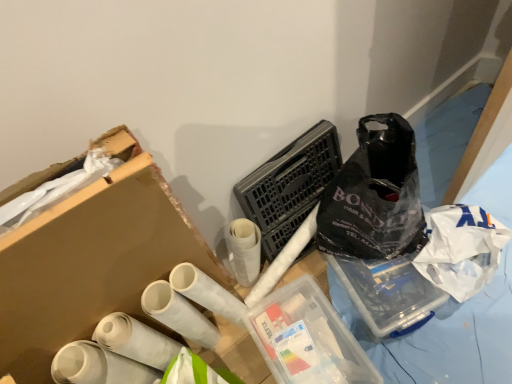
Question: Does transparent plastic container at center have a lesser height compared to white matte toilet paper at lower left, which appears as the second toilet paper when viewed from the right?

Choices:
 (A) yes
 (B) no

Answer: (A)

Question: From a real-world perspective, is transparent plastic container at center located higher than white matte toilet paper at lower left, which appears as the second toilet paper when viewed from the right?

Choices:
 (A) no
 (B) yes

Answer: (A)

Question: Does transparent plastic container at center turn towards white matte toilet paper at lower left, the 2th toilet paper from the left?

Choices:
 (A) yes
 (B) no

Answer: (B)

Question: Is transparent plastic container at center beside white matte toilet paper at lower left, which appears as the second toilet paper when viewed from the right?

Choices:
 (A) no
 (B) yes

Answer: (A)

Question: Is transparent plastic container at center further to camera compared to white matte toilet paper at lower left, the 2th toilet paper from the left?

Choices:
 (A) yes
 (B) no

Answer: (A)

Question: Would you say transparent plastic container at center is inside or outside white matte toilet paper at lower left, the 3th toilet paper when ordered from right to left?

Choices:
 (A) inside
 (B) outside

Answer: (B)

Question: Is transparent plastic container at center wider or thinner than white matte toilet paper at lower left, the 3th toilet paper when ordered from right to left?

Choices:
 (A) wide
 (B) thin

Answer: (A)

Question: Is point (349, 347) positioned closer to the camera than point (110, 357)?

Choices:
 (A) farther
 (B) closer

Answer: (A)

Question: Considering the positions of transparent plastic container at center and white matte toilet paper at lower left, positioned as the first toilet paper in left-to-right order, in the image, is transparent plastic container at center bigger or smaller than white matte toilet paper at lower left, positioned as the first toilet paper in left-to-right order,?

Choices:
 (A) small
 (B) big

Answer: (B)

Question: Is white matte toilet paper at lower left, which appears as the second toilet paper when viewed from the right, situated inside transparent plastic container at center or outside?

Choices:
 (A) outside
 (B) inside

Answer: (A)

Question: In terms of size, does white matte toilet paper at lower left, which appears as the second toilet paper when viewed from the right, appear bigger or smaller than transparent plastic container at center?

Choices:
 (A) big
 (B) small

Answer: (B)

Question: From the image's perspective, relative to transparent plastic container at center, is white matte toilet paper at lower left, which appears as the second toilet paper when viewed from the right, above or below?

Choices:
 (A) above
 (B) below

Answer: (A)

Question: Considering the positions of white matte toilet paper at lower left, the 2th toilet paper from the left, and transparent plastic container at center in the image, is white matte toilet paper at lower left, the 2th toilet paper from the left, taller or shorter than transparent plastic container at center?

Choices:
 (A) short
 (B) tall

Answer: (B)

Question: Based on their sizes in the image, would you say white matte toilet paper at lower left, the 2th toilet paper from the left, is bigger or smaller than black plastic laundry basket at center?

Choices:
 (A) small
 (B) big

Answer: (A)

Question: Is point (159, 357) closer or farther from the camera than point (283, 208)?

Choices:
 (A) closer
 (B) farther

Answer: (A)